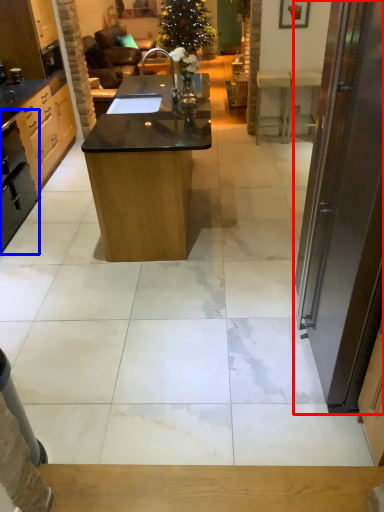
Question: Which object is further to the camera taking this photo, door (highlighted by a red box) or appliance (highlighted by a blue box)?

Choices:
 (A) door
 (B) appliance

Answer: (B)